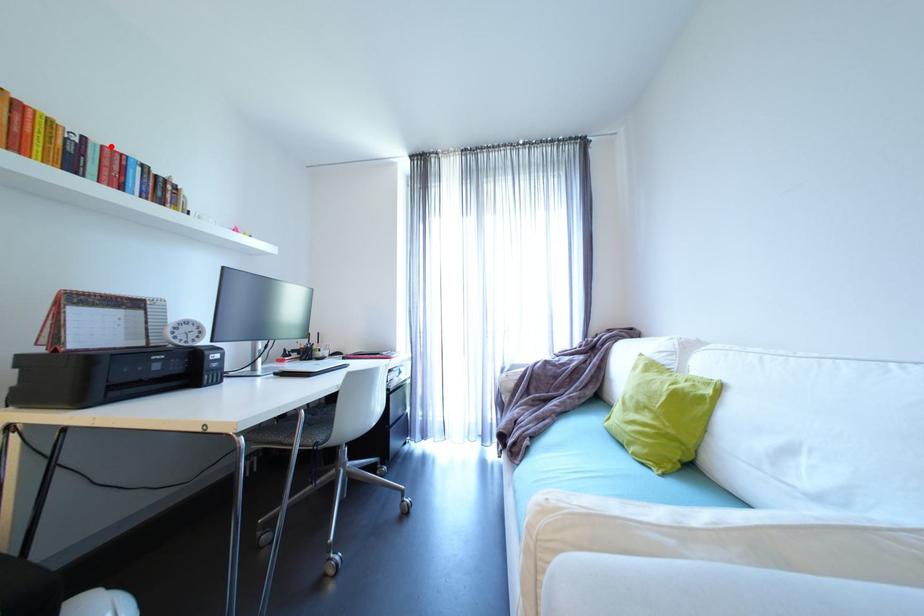
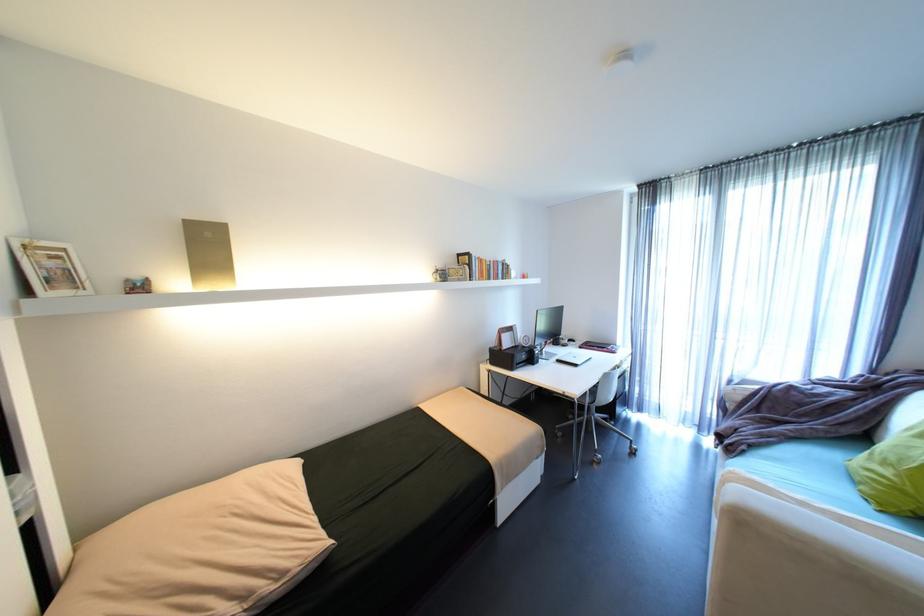
Question: I am providing you with two images of the same scene from different viewpoints. A red point is marked on the first image. Is the red point's position out of view in image 2?

Choices:
 (A) Yes
 (B) No

Answer: (B)